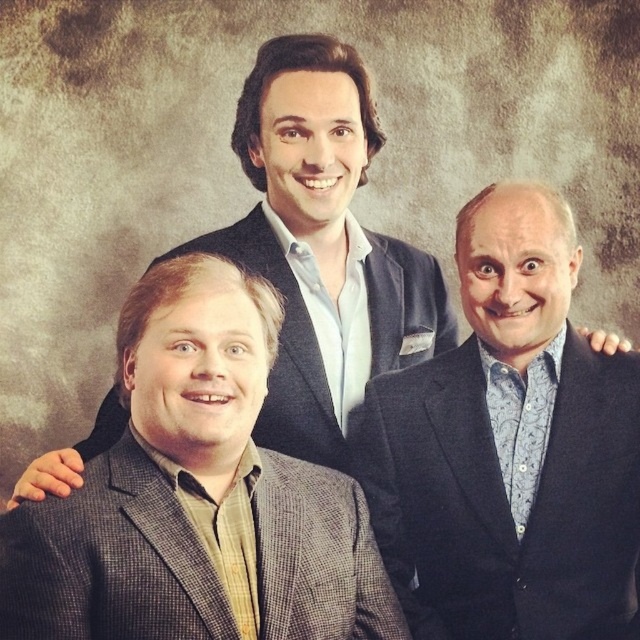
Does gray checkered suit at lower left have a greater width compared to gray wool blazer at center?

No, gray checkered suit at lower left is not wider than gray wool blazer at center.

Does point (188, 588) come farther from viewer compared to point (396, 241)?

No.

Who is more forward, (348,518) or (188,243)?

Point (348,518) is more forward.

Image resolution: width=640 pixels, height=640 pixels. I want to click on gray checkered suit at lower left, so click(112, 557).

Measure the distance between point (552, 522) and camera.

Point (552, 522) and camera are 4.99 feet apart.

Is the position of dark blue woolen suit at center more distant than that of gray wool blazer at center?

That is False.

What do you see at coordinates (504, 500) in the screenshot? The height and width of the screenshot is (640, 640). I see `dark blue woolen suit at center` at bounding box center [504, 500].

Locate an element on the screen. dark blue woolen suit at center is located at coordinates (504, 500).

Is matte black suit at center bigger than gray checkered suit at lower left?

Correct, matte black suit at center is larger in size than gray checkered suit at lower left.

Does matte black suit at center appear over gray checkered suit at lower left?

Correct, matte black suit at center is located above gray checkered suit at lower left.

Who is more forward, (x=348, y=340) or (x=56, y=621)?

Positioned in front is point (x=56, y=621).

Locate an element on the screen. Image resolution: width=640 pixels, height=640 pixels. matte black suit at center is located at coordinates (321, 243).